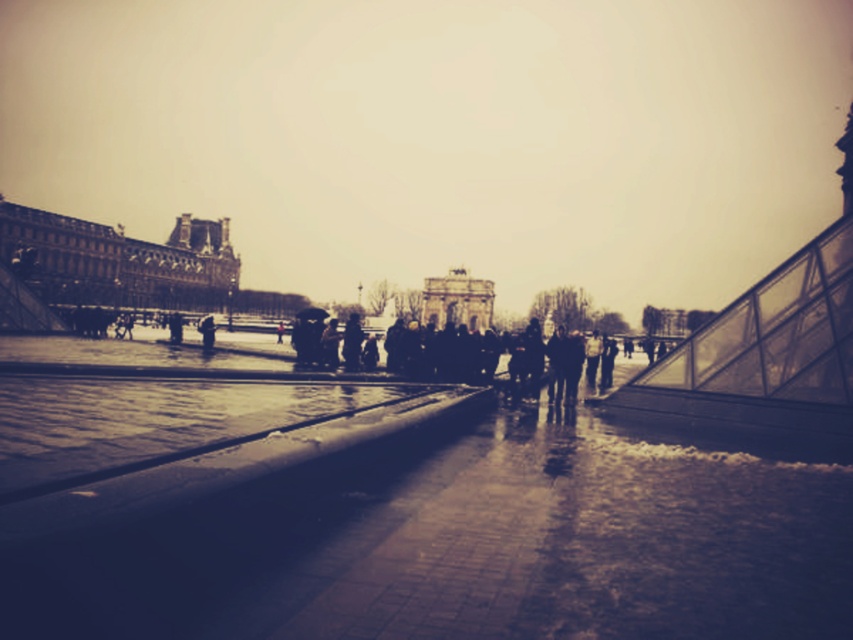
In the scene shown: You are a tourist standing in the middle of the square, and you want to take a photo of the dark brown stone palace at left and the stone archway at center. Which one should you focus on first to ensure both are in the frame?

Answer: The dark brown stone palace at left is in front of the stone archway at center, so you should focus on the stone archway at center first to ensure both are in the frame.

You are a tourist in Paris holding an umbrella. You notice a dark gray fabric coat at center and a point marked at coordinates (526, 362). Where exactly is the point located relative to the dark gray fabric coat at center?

The point at (526, 362) is located on the dark gray fabric coat at center.